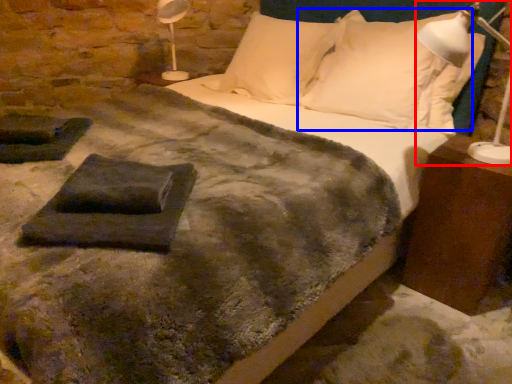
Question: Which object appears farthest to the camera in this image, bedside lamp (highlighted by a red box) or pillow (highlighted by a blue box)?

Choices:
 (A) bedside lamp
 (B) pillow

Answer: (B)